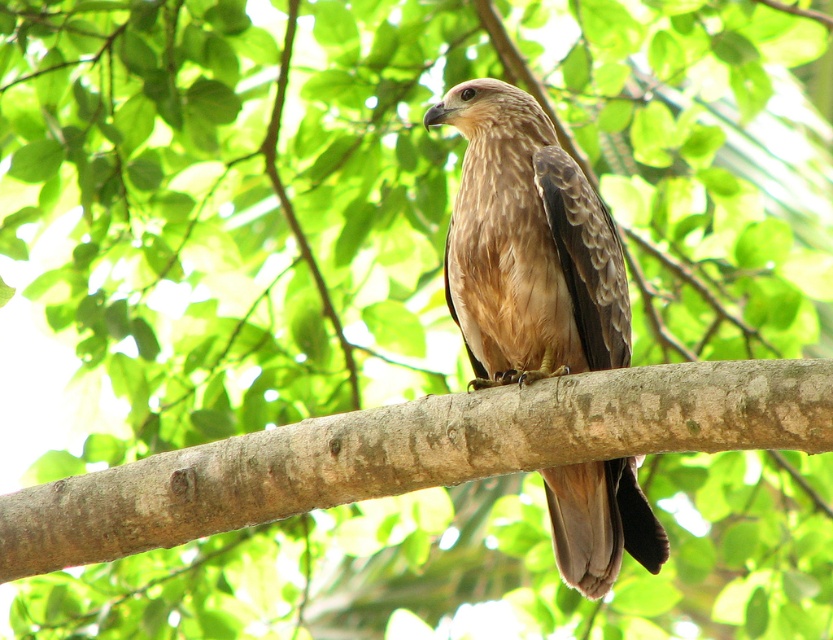
Is point (552, 392) less distant than point (571, 188)?

Yes.

Is brown rough tree branch at center behind brown feathered eagle at center?

No, brown rough tree branch at center is in front of brown feathered eagle at center.

Does point (574, 422) come behind point (482, 289)?

No, (574, 422) is closer to viewer.

Where is `brown rough tree branch at center`? The width and height of the screenshot is (833, 640). brown rough tree branch at center is located at coordinates (413, 452).